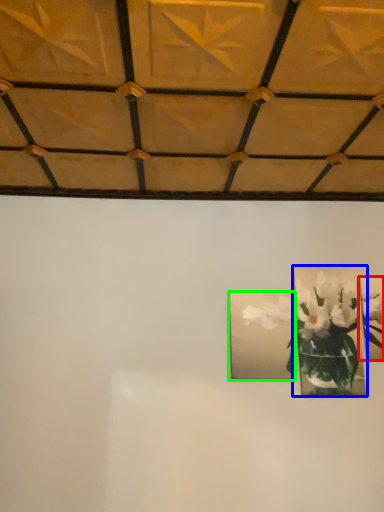
Question: Considering the real-world distances, which object is farthest from picture frame (highlighted by a red box)? picture frame (highlighted by a blue box) or picture frame (highlighted by a green box)?

Choices:
 (A) picture frame
 (B) picture frame

Answer: (B)